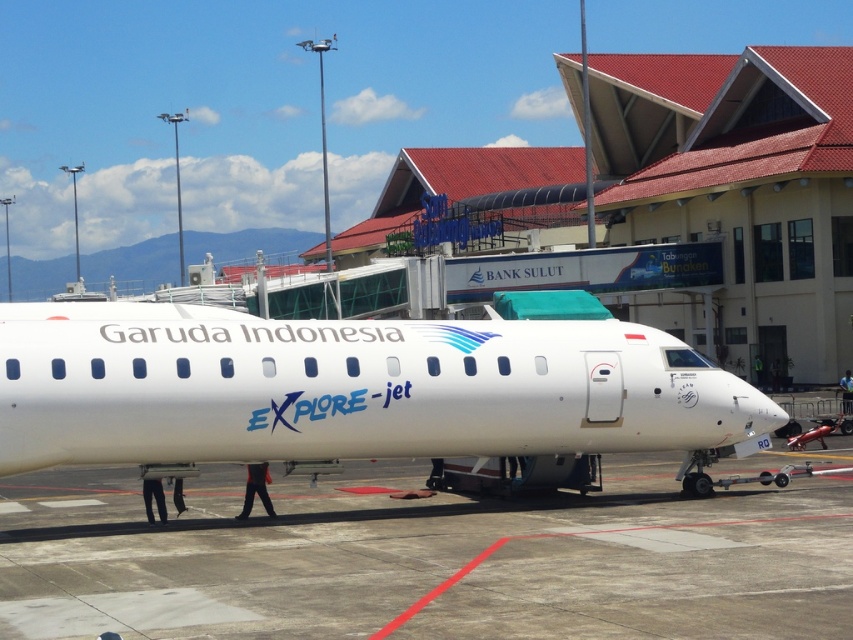
Does concrete at center appear on the left side of white glossy airplane at center?

In fact, concrete at center is to the right of white glossy airplane at center.

What do you see at coordinates (430, 561) in the screenshot? The image size is (853, 640). I see `concrete at center` at bounding box center [430, 561].

Where is `concrete at center`? This screenshot has width=853, height=640. concrete at center is located at coordinates (430, 561).